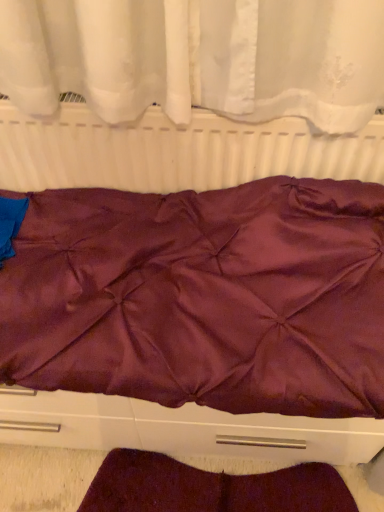
This screenshot has width=384, height=512. I want to click on vacant space situated above burgundy satin blanket at lower center (from a real-world perspective), so click(206, 489).